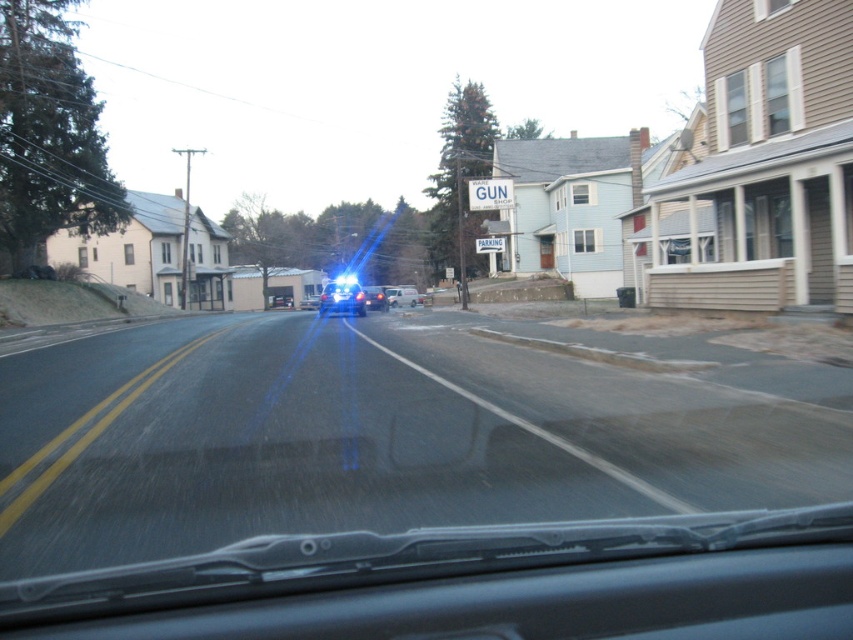
You are driving a car and want to ensure you can see clearly through the transparent glass windshield at center. Given that the windshield is 8.63 feet away from your eyes, is this distance typical for a driver to have an unobstructed view?

The transparent glass windshield at center is 8.63 feet away from the camera, which is a standard distance for a driver to have an unobstructed view.

You are a passenger in the car and want to know if the point at coordinate [405,490] is on the windshield. Can you confirm?

Yes, the point at coordinate [405,490] is on the transparent glass windshield at center.

You are a passenger in a car and want to know where the transparent glass windshield at center is located in the image. Please provide its coordinates based on the image grid system where the bottom left corner is the origin point.

The transparent glass windshield at center is located at coordinates point [405,490].